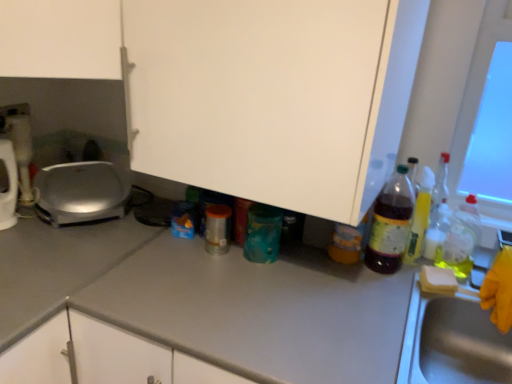
You are a GUI agent. You are given a task and a screenshot of the screen. Output one action in this format:
    pyautogui.click(x=<x>, y=<y>)
    Task: Click on the vacant region to the left of metallic silver can at center, which appears as the 1th bottle when viewed from the left
    Image resolution: width=512 pixels, height=384 pixels.
    Given the screenshot: What is the action you would take?
    pyautogui.click(x=163, y=249)